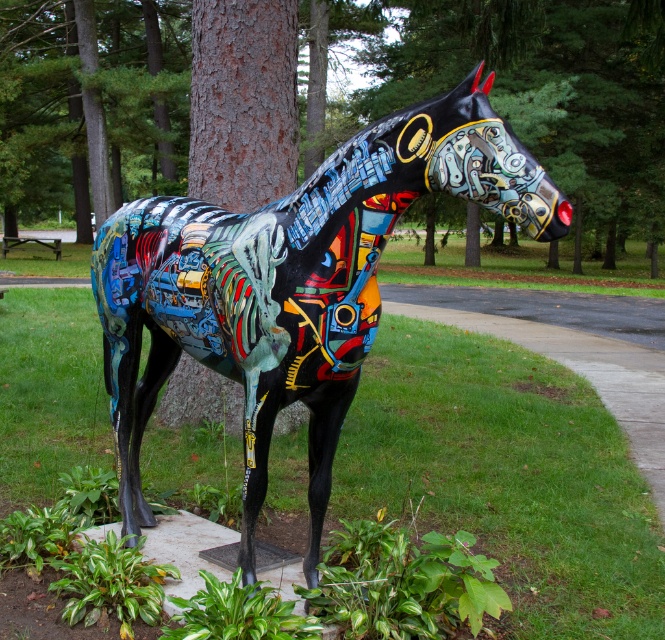
Question: Can you confirm if brown textured tree trunk at center is bigger than brown rough bark tree at center?

Choices:
 (A) no
 (B) yes

Answer: (B)

Question: Which object is positioned closest to the metallic painted horse at center?

Choices:
 (A) brown textured tree trunk at center
 (B) brown rough bark tree at center

Answer: (B)

Question: Is brown textured tree trunk at center above brown rough bark tree at center?

Choices:
 (A) yes
 (B) no

Answer: (A)

Question: Does brown textured tree trunk at center come behind brown rough bark tree at center?

Choices:
 (A) no
 (B) yes

Answer: (B)

Question: Considering the real-world distances, which object is farthest from the brown rough bark tree at center?

Choices:
 (A) metallic painted horse at center
 (B) brown textured tree trunk at center

Answer: (B)

Question: Which of the following is the farthest from the observer?

Choices:
 (A) (297, 152)
 (B) (251, 467)

Answer: (A)